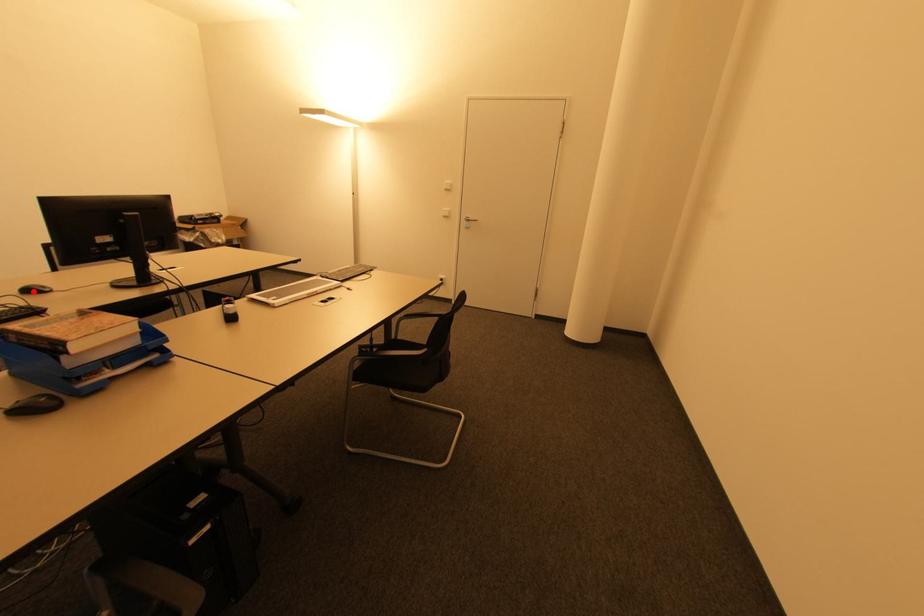
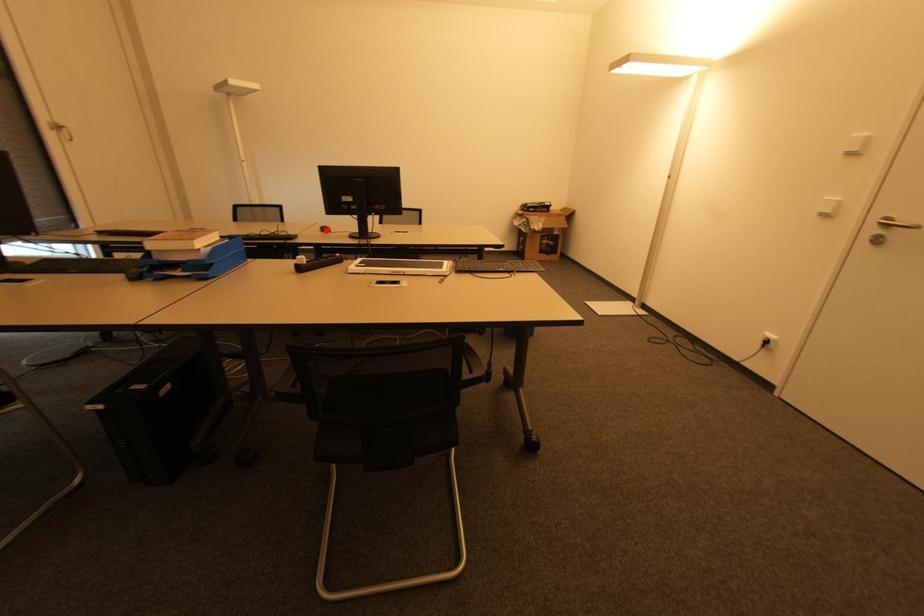
From the picture: I am providing you with two images of the same scene from different viewpoints. A red point is marked on the first image and another point is marked on the second image. Is the marked point in image1 the same physical position as the marked point in image2?

Yes